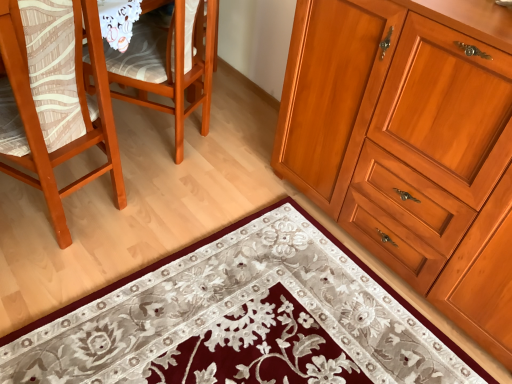
Where is `vacant region in front of wooden chair at left, placed as the 2th chair when sorted from left to right`? vacant region in front of wooden chair at left, placed as the 2th chair when sorted from left to right is located at coordinates (163, 194).